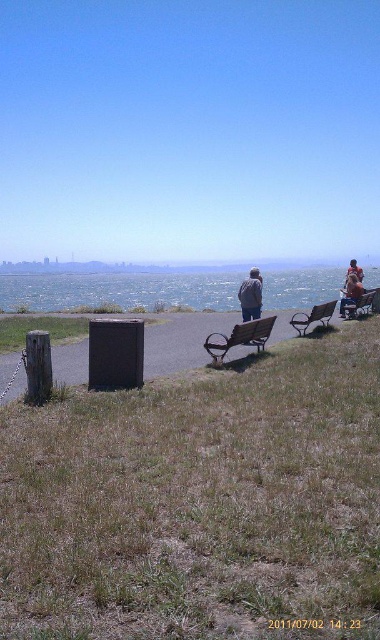
You are standing at the point marked by the coordinates point (120, 291). Looking around, what do you see in the immediate vicinity?

The point (120, 291) indicates blue water at center, so you would see blue water at center in your immediate vicinity.

You are a photographer planning to capture a wide shot of the rustic wood bench at center and the denim jacket at center for a travel blog. Given that your camera has a maximum focus range of 1.5 meters, will both objects be in focus if they are placed exactly 1.3 meters apart?

The rustic wood bench at center is bigger than the denim jacket at center, but since the distance between them is 1.3 meters, which is within the camera focus range of 1.5 meters, both objects will be in focus.